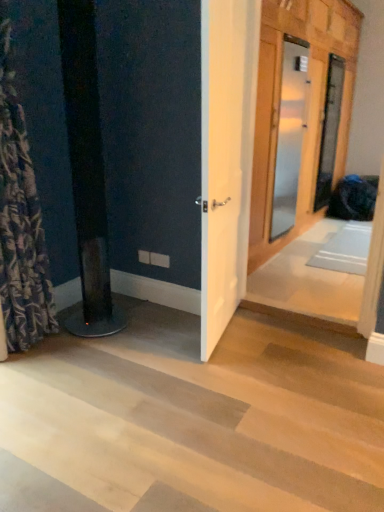
Find the location of a particular element. The image size is (384, 512). patterned fabric shower curtain at left is located at coordinates (20, 219).

The width and height of the screenshot is (384, 512). Find the location of `wooden door at center, marked as the second door in a right-to-left arrangement`. wooden door at center, marked as the second door in a right-to-left arrangement is located at coordinates (309, 109).

Find the location of a particular element. This screenshot has height=512, width=384. wooden door at center, marked as the first door in a right-to-left arrangement is located at coordinates (329, 131).

You are a GUI agent. You are given a task and a screenshot of the screen. Output one action in this format:
    pyautogui.click(x=<x>, y=<y>)
    Task: Click on the patterned fabric shower curtain at left
    
    Given the screenshot: What is the action you would take?
    pyautogui.click(x=20, y=219)

From the picture: From a real-world perspective, is patterned fabric shower curtain at left located higher than white wood door at center?

No, from a real-world perspective, patterned fabric shower curtain at left is not above white wood door at center.

How distant is patterned fabric shower curtain at left from white wood door at center?

A distance of 1.03 meters exists between patterned fabric shower curtain at left and white wood door at center.

Which is more to the right, patterned fabric shower curtain at left or white wood door at center?

Positioned to the right is white wood door at center.

Considering the relative sizes of patterned fabric shower curtain at left and white wood door at center in the image provided, is patterned fabric shower curtain at left thinner than white wood door at center?

No, patterned fabric shower curtain at left is not thinner than white wood door at center.

How many degrees apart are the facing directions of wooden door at center, the first door from the left, and white wood door at center?

The angular difference between wooden door at center, the first door from the left, and white wood door at center is 14.3 degrees.

Which of these two, wooden door at center, the first door from the left, or white wood door at center, stands shorter?

wooden door at center, the first door from the left, is shorter.

Between wooden door at center, placed as the third door when sorted from right to left, and white wood door at center, which one has smaller size?

Smaller between the two is white wood door at center.

Consider the image. Between black glossy speaker at left and wooden door at center, arranged as the 2th door when viewed from the left, which one appears on the left side from the viewer's perspective?

From the viewer's perspective, black glossy speaker at left appears more on the left side.

Is point (69, 73) less distant than point (260, 108)?

Yes.

Is black glossy speaker at left bigger or smaller than wooden door at center, arranged as the 2th door when viewed from the left?

In the image, black glossy speaker at left appears to be smaller than wooden door at center, arranged as the 2th door when viewed from the left.

From the picture: Is wooden door at center, placed as the third door when sorted from right to left, at the left side of patterned fabric shower curtain at left?

Incorrect, wooden door at center, placed as the third door when sorted from right to left, is not on the left side of patterned fabric shower curtain at left.

From the picture: Is wooden door at center, the first door from the left, aimed at patterned fabric shower curtain at left?

No, wooden door at center, the first door from the left, is not turned towards patterned fabric shower curtain at left.

From a real-world perspective, is wooden door at center, the first door from the left, located higher than patterned fabric shower curtain at left?

Correct, in the physical world, wooden door at center, the first door from the left, is higher than patterned fabric shower curtain at left.

Does wooden door at center, the first door from the left, have a greater width compared to patterned fabric shower curtain at left?

In fact, wooden door at center, the first door from the left, might be narrower than patterned fabric shower curtain at left.

Does wooden door at center, placed as the third door when sorted from right to left, have a lesser height compared to black glossy speaker at left?

Yes.

Is wooden door at center, the first door from the left, wider or thinner than black glossy speaker at left?

In the image, wooden door at center, the first door from the left, appears to be more narrow than black glossy speaker at left.

Between wooden door at center, the first door from the left, and black glossy speaker at left, which one has larger size?

black glossy speaker at left is bigger.

From a real-world perspective, which object stands above the other?

wooden door at center, the first door from the left, is physically above.

Is point (162, 437) closer to viewer compared to point (287, 226)?

Yes, point (162, 437) is closer to viewer.

Are natural wood stairwell at lower left and wooden door at center, the first door from the left, far apart?

Yes, natural wood stairwell at lower left and wooden door at center, the first door from the left, are quite far apart.

From their relative heights in the image, would you say natural wood stairwell at lower left is taller or shorter than wooden door at center, the first door from the left?

natural wood stairwell at lower left is shorter than wooden door at center, the first door from the left.

Can you confirm if natural wood stairwell at lower left is positioned to the right of wooden door at center, placed as the third door when sorted from right to left?

No.

Could you tell me if black glossy speaker at left is facing white wood door at center?

Yes.

Can you confirm if black glossy speaker at left is thinner than white wood door at center?

In fact, black glossy speaker at left might be wider than white wood door at center.

Is black glossy speaker at left surrounding white wood door at center?

No, white wood door at center is not surrounded by black glossy speaker at left.

In the scene shown: Is black glossy speaker at left not near white wood door at center?

Actually, black glossy speaker at left and white wood door at center are a little close together.

Identify the location of barn door lying behind the patterned fabric shower curtain at left. Image resolution: width=384 pixels, height=512 pixels. (226, 157).

The image size is (384, 512). I want to click on the 1st door located above the white wood door at center (from a real-world perspective), so click(290, 134).

From the image, which object appears to be nearer to wooden door at center, the first door from the left, black glossy speaker at left or wooden door at center, marked as the second door in a right-to-left arrangement?

Among the two, wooden door at center, marked as the second door in a right-to-left arrangement, is located nearer to wooden door at center, the first door from the left.

Which object lies further to the anchor point wooden door at center, marked as the first door in a right-to-left arrangement, patterned fabric shower curtain at left or black glossy speaker at left?

patterned fabric shower curtain at left lies further to wooden door at center, marked as the first door in a right-to-left arrangement, than the other object.

Looking at the image, which one is located closer to black glossy speaker at left, patterned fabric shower curtain at left or wooden door at center, the first door from the left?

patterned fabric shower curtain at left lies closer to black glossy speaker at left than the other object.

Looking at the image, which one is located further to patterned fabric shower curtain at left, natural wood stairwell at lower left or black glossy speaker at left?

Among the two, natural wood stairwell at lower left is located further to patterned fabric shower curtain at left.

When comparing their distances from patterned fabric shower curtain at left, does wooden door at center, arranged as the 2th door when viewed from the left, or wooden door at center, the first door from the left, seem closer?

wooden door at center, arranged as the 2th door when viewed from the left, is closer to patterned fabric shower curtain at left.

From the image, which object appears to be farther from wooden door at center, marked as the second door in a right-to-left arrangement, wooden door at center, arranged as the 3th door when viewed from the left, or natural wood stairwell at lower left?

Among the two, natural wood stairwell at lower left is located further to wooden door at center, marked as the second door in a right-to-left arrangement.

Which object lies further to the anchor point natural wood stairwell at lower left, wooden door at center, arranged as the 3th door when viewed from the left, or wooden door at center, placed as the third door when sorted from right to left?

wooden door at center, arranged as the 3th door when viewed from the left.

Looking at the image, which one is located closer to wooden door at center, arranged as the 2th door when viewed from the left, white wood door at center or black glossy speaker at left?

white wood door at center is positioned closer to the anchor wooden door at center, arranged as the 2th door when viewed from the left.

Identify the location of pillar between patterned fabric shower curtain at left and wooden door at center, arranged as the 2th door when viewed from the left, in the horizontal direction. The height and width of the screenshot is (512, 384). (87, 169).

What are the coordinates of `door situated between black glossy speaker at left and wooden door at center, arranged as the 2th door when viewed from the left, from left to right` in the screenshot? It's located at (290, 134).

This screenshot has width=384, height=512. What are the coordinates of `barn door positioned between natural wood stairwell at lower left and wooden door at center, arranged as the 3th door when viewed from the left, from near to far` in the screenshot? It's located at (226, 157).

You are a GUI agent. You are given a task and a screenshot of the screen. Output one action in this format:
    pyautogui.click(x=<x>, y=<y>)
    Task: Click on the barn door located between natural wood stairwell at lower left and wooden door at center, the first door from the left, in the depth direction
    The width and height of the screenshot is (384, 512).
    Given the screenshot: What is the action you would take?
    pyautogui.click(x=226, y=157)